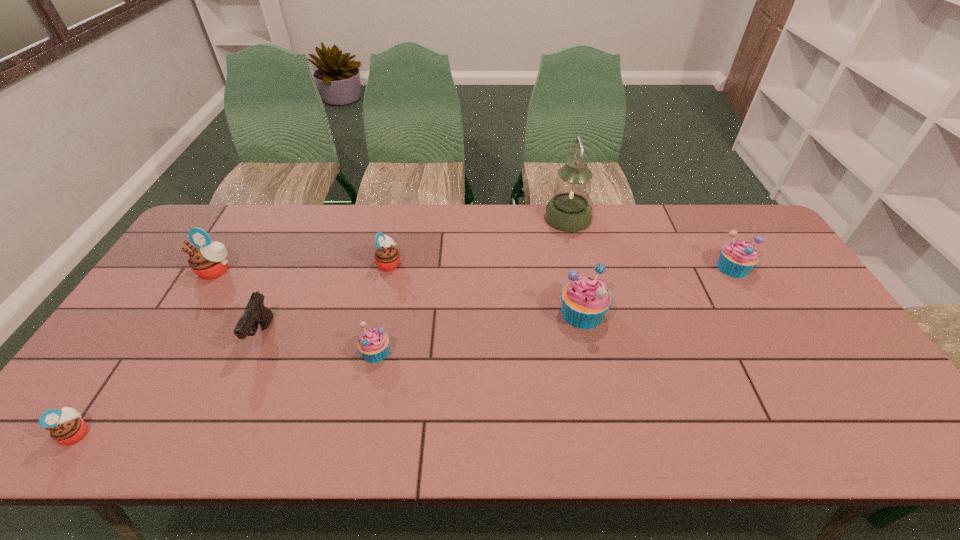
This screenshot has width=960, height=540. In order to click on vacant area that lies between the seventh object from right to left and the leftmost blue muffin in this screenshot , I will do coord(296,311).

Find the location of a particular element. object that is the seventh closest one to the leftmost muffin is located at coordinates (737, 259).

Locate an element on the screen. The image size is (960, 540). the seventh closest object to the nearest blue muffin is located at coordinates (737, 259).

Identify the location of muffin that is the fifth closest to the nearest blue muffin. (737, 259).

Where is `muffin that stands as the second closest to the rightmost pink muffin`? muffin that stands as the second closest to the rightmost pink muffin is located at coordinates (208, 260).

In order to click on blue muffin identified as the closest to the second pink muffin from left to right in this screenshot , I will do `click(373, 344)`.

The width and height of the screenshot is (960, 540). I want to click on blue muffin that is the second nearest to the leftmost object, so tap(585, 301).

Locate an element on the screen. The width and height of the screenshot is (960, 540). pink muffin that is the third nearest to the second smallest blue muffin is located at coordinates (66, 427).

In order to click on pink muffin that can be found as the closest to the nearest pink muffin in this screenshot , I will do `click(208, 260)`.

Find the location of a particular element. vacant space that satisfies the following two spatial constraints: 1. on the front-facing side of the second pink muffin from left to right; 2. on the front-facing side of the leftmost object is located at coordinates (118, 433).